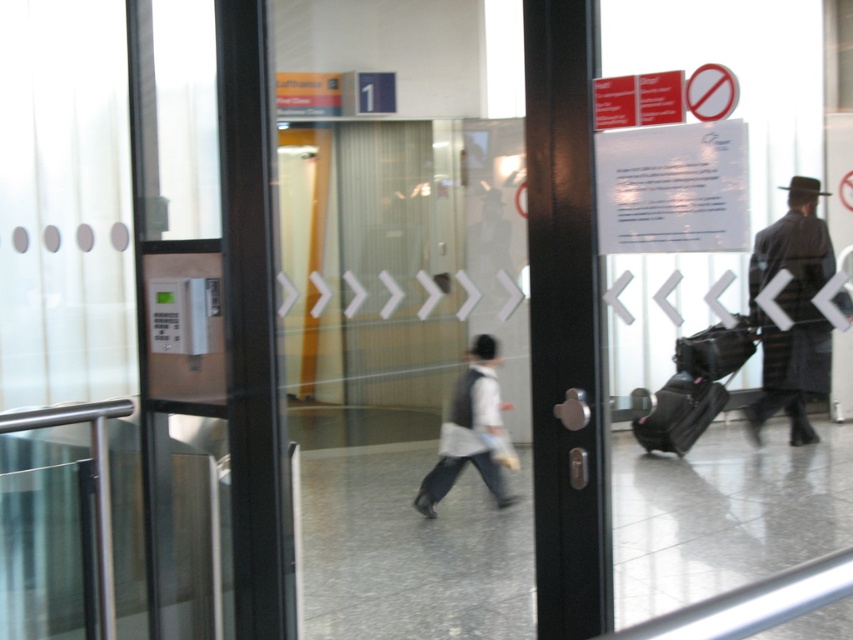
You are a passenger at the Lufthansa First Class and Business Class check in area. You see a white fabric shirt at center and a black fabric suitcase at right. Which object is closer to you?

The white fabric shirt at center is closer to you because the black fabric suitcase at right is behind it.

You are a traveler standing at the Lufthansa First Class and Business Class check in area. You see a dark wool coat at right and a black fabric suitcase at lower right. Which item is higher up?

The dark wool coat at right is above the black fabric suitcase at lower right, so the dark wool coat at right is higher up.